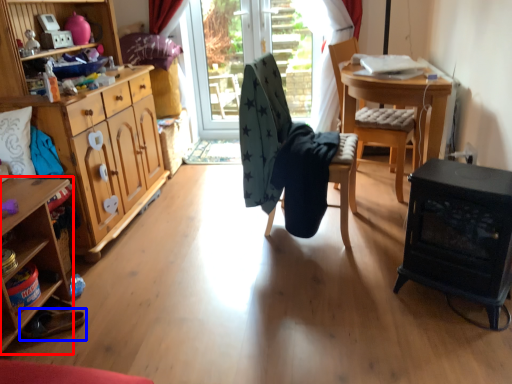
Question: Which object is further to the camera taking this photo, desk (highlighted by a red box) or footwear (highlighted by a blue box)?

Choices:
 (A) desk
 (B) footwear

Answer: (B)